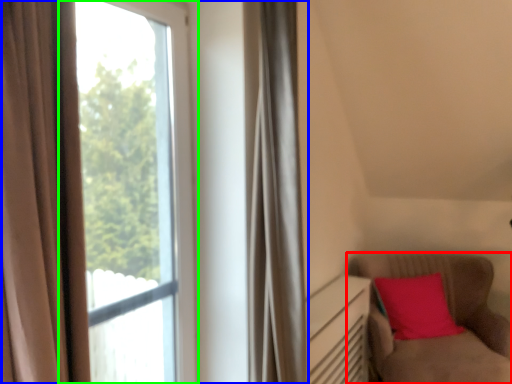
Question: Which object is the closest to the furniture (highlighted by a red box)? Choose among these: window (highlighted by a blue box) or window (highlighted by a green box).

Choices:
 (A) window
 (B) window

Answer: (B)